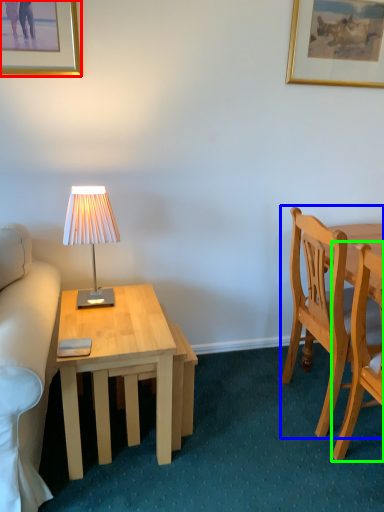
Question: Which object is the closest to the picture frame (highlighted by a red box)? Choose among these: chair (highlighted by a blue box) or chair (highlighted by a green box).

Choices:
 (A) chair
 (B) chair

Answer: (A)